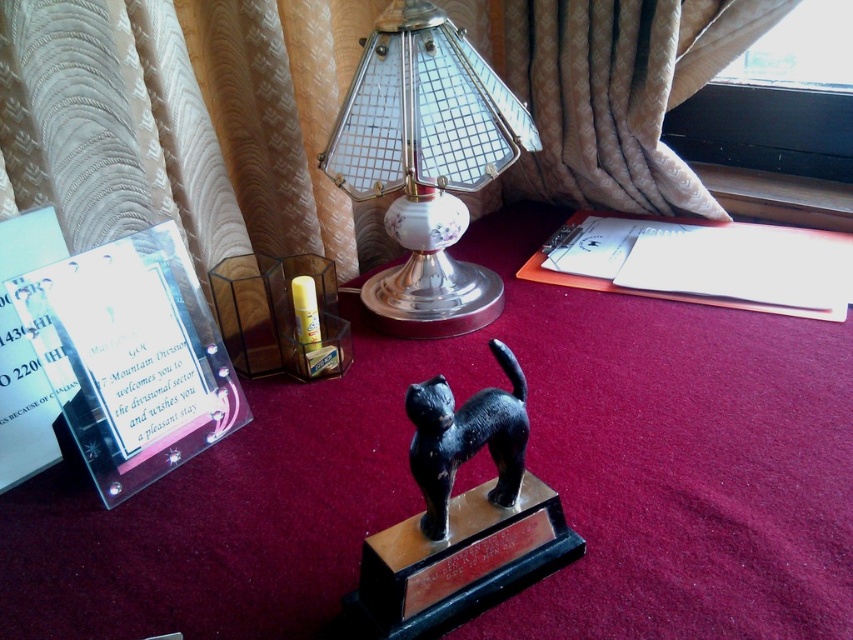
Question: Among these objects, which one is farthest from the camera?

Choices:
 (A) metallic trophy at center
 (B) black glossy cat at center
 (C) metallic glass lampshade at center

Answer: (C)

Question: Can you confirm if metallic trophy at center is smaller than metallic glass lampshade at center?

Choices:
 (A) yes
 (B) no

Answer: (B)

Question: Which object is positioned farthest from the metallic trophy at center?

Choices:
 (A) black glossy cat at center
 (B) metallic glass lampshade at center

Answer: (A)

Question: Which object appears farthest from the camera in this image?

Choices:
 (A) black glossy cat at center
 (B) metallic trophy at center

Answer: (B)

Question: Is metallic trophy at center thinner than black glossy cat at center?

Choices:
 (A) yes
 (B) no

Answer: (B)

Question: Observing the image, what is the correct spatial positioning of metallic glass lampshade at center in reference to black glossy cat at center?

Choices:
 (A) below
 (B) above

Answer: (B)